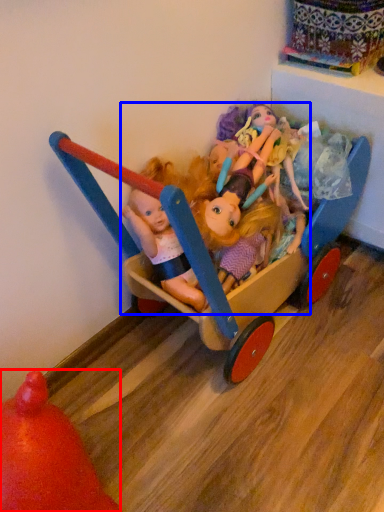
Question: Which object appears farthest to the camera in this image, toy (highlighted by a red box) or doll (highlighted by a blue box)?

Choices:
 (A) toy
 (B) doll

Answer: (B)